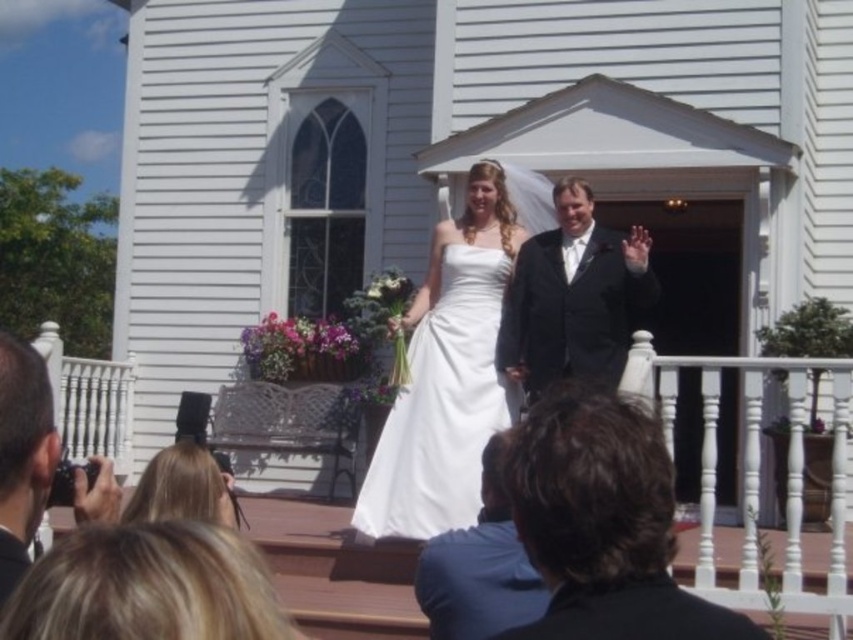
Question: Does white satin dress at center have a larger size compared to black satin suit at center?

Choices:
 (A) no
 (B) yes

Answer: (A)

Question: Is white wooden porch at center thinner than blonde hair at lower left?

Choices:
 (A) no
 (B) yes

Answer: (A)

Question: Which object is the farthest from the white satin dress at center?

Choices:
 (A) blonde hair at lower left
 (B) matte black camera at lower left

Answer: (B)

Question: From the image, what is the correct spatial relationship of white wooden church at center in relation to blue fabric shirt at center?

Choices:
 (A) above
 (B) below

Answer: (A)

Question: Which point is farther to the camera?

Choices:
 (A) (556, 353)
 (B) (543, 502)
 (C) (465, 348)
 (D) (170, 451)

Answer: (A)

Question: Which object is the closest to the black satin suit at center?

Choices:
 (A) white satin dress at center
 (B) black suit at center
 (C) blue fabric shirt at center
 (D) blonde hair at lower left

Answer: (A)